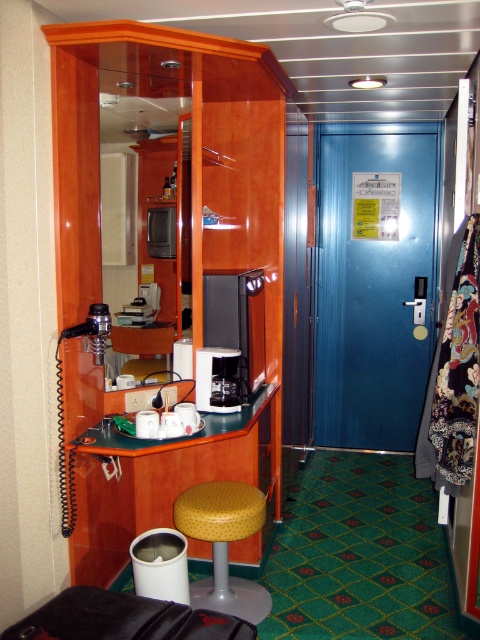
Can you confirm if leather-like black hassock at lower center is thinner than yellow fabric stool at lower center?

No.

Can you confirm if leather-like black hassock at lower center is shorter than yellow fabric stool at lower center?

Correct, leather-like black hassock at lower center is not as tall as yellow fabric stool at lower center.

Identify the location of leather-like black hassock at lower center. This screenshot has height=640, width=480. (123, 618).

I want to click on leather-like black hassock at lower center, so click(123, 618).

Which of these two, yellow textured stool at center or satin black coffee machine at center, stands shorter?

Standing shorter between the two is satin black coffee machine at center.

Does yellow textured stool at center have a smaller size compared to satin black coffee machine at center?

Actually, yellow textured stool at center might be larger than satin black coffee machine at center.

Locate an element on the screen. yellow textured stool at center is located at coordinates (224, 544).

The image size is (480, 640). In order to click on yellow textured stool at center in this screenshot , I will do `click(224, 544)`.

Who is more distant from viewer, (35, 637) or (218, 381)?

The point (218, 381) is more distant.

Between leather-like black hassock at lower center and satin black coffee machine at center, which one has less height?

With less height is leather-like black hassock at lower center.

This screenshot has width=480, height=640. I want to click on leather-like black hassock at lower center, so click(123, 618).

Where is `leather-like black hassock at lower center`? leather-like black hassock at lower center is located at coordinates (123, 618).